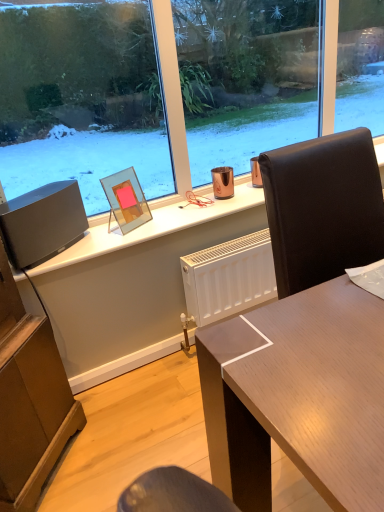
Locate an element on the screen. Image resolution: width=384 pixels, height=512 pixels. transparent glass picture frame at upper center is located at coordinates (126, 200).

This screenshot has width=384, height=512. What do you see at coordinates (126, 200) in the screenshot?
I see `transparent glass picture frame at upper center` at bounding box center [126, 200].

What do you see at coordinates (42, 223) in the screenshot?
I see `matte black speaker at left` at bounding box center [42, 223].

The image size is (384, 512). I want to click on matte black speaker at left, so click(42, 223).

Find the location of a particular element. This screenshot has height=512, width=384. transparent glass picture frame at upper center is located at coordinates (126, 200).

Between transparent glass picture frame at upper center and matte black speaker at left, which one appears on the left side from the viewer's perspective?

matte black speaker at left.

Between transparent glass picture frame at upper center and matte black speaker at left, which one is positioned behind?

Positioned behind is transparent glass picture frame at upper center.

Consider the image. Which point is more distant from viewer, (132, 222) or (22, 242)?

The point (132, 222) is farther from the camera.

From the image's perspective, who appears lower, transparent glass picture frame at upper center or matte black speaker at left?

matte black speaker at left appears lower in the image.

From a real-world perspective, who is located lower, transparent glass picture frame at upper center or matte black speaker at left?

matte black speaker at left, from a real-world perspective.

Considering the sizes of objects transparent glass picture frame at upper center and matte black speaker at left in the image provided, who is wider, transparent glass picture frame at upper center or matte black speaker at left?

matte black speaker at left is wider.

Which of these two, transparent glass picture frame at upper center or matte black speaker at left, stands taller?

Standing taller between the two is transparent glass picture frame at upper center.

Looking at the image, does transparent glass picture frame at upper center seem bigger or smaller compared to matte black speaker at left?

In the image, transparent glass picture frame at upper center appears to be smaller than matte black speaker at left.

Is transparent glass picture frame at upper center inside the boundaries of matte black speaker at left, or outside?

transparent glass picture frame at upper center cannot be found inside matte black speaker at left.

Are transparent glass picture frame at upper center and matte black speaker at left far apart?

No, there isn't a large distance between transparent glass picture frame at upper center and matte black speaker at left.

Could you tell me if transparent glass picture frame at upper center is turned towards matte black speaker at left?

No.

Can you tell me how much transparent glass picture frame at upper center and matte black speaker at left differ in facing direction?

The facing directions of transparent glass picture frame at upper center and matte black speaker at left are 5.37 degrees apart.

Identify the location of loudspeaker below the transparent glass picture frame at upper center (from a real-world perspective). The height and width of the screenshot is (512, 384). (42, 223).

Considering the positions of objects matte black speaker at left and transparent glass picture frame at upper center in the image provided, who is more to the left, matte black speaker at left or transparent glass picture frame at upper center?

matte black speaker at left is more to the left.

Consider the image. Which is in front, matte black speaker at left or transparent glass picture frame at upper center?

matte black speaker at left is in front.

Does point (76, 240) appear closer or farther from the camera than point (115, 183)?

Clearly, point (76, 240) is closer to the camera than point (115, 183).

Looking at this image, from the image's perspective, is matte black speaker at left under transparent glass picture frame at upper center?

Yes, from the image's perspective, matte black speaker at left is beneath transparent glass picture frame at upper center.

From a real-world perspective, which is physically below, matte black speaker at left or transparent glass picture frame at upper center?

matte black speaker at left, from a real-world perspective.

In the scene shown: In terms of width, does matte black speaker at left look wider or thinner when compared to transparent glass picture frame at upper center?

Clearly, matte black speaker at left has more width compared to transparent glass picture frame at upper center.

In terms of height, does matte black speaker at left look taller or shorter compared to transparent glass picture frame at upper center?

matte black speaker at left is shorter than transparent glass picture frame at upper center.

Which of these two, matte black speaker at left or transparent glass picture frame at upper center, is smaller?

transparent glass picture frame at upper center.

Can we say matte black speaker at left lies outside transparent glass picture frame at upper center?

Yes, matte black speaker at left is outside of transparent glass picture frame at upper center.

In the scene shown: Is matte black speaker at left not near transparent glass picture frame at upper center?

matte black speaker at left is actually quite close to transparent glass picture frame at upper center.

Is transparent glass picture frame at upper center at the back of matte black speaker at left?

That's not correct — matte black speaker at left is not looking away from transparent glass picture frame at upper center.

At what (x,y) coordinates should I click in order to perform the action: click on loudspeaker in front of the transparent glass picture frame at upper center. Please return your answer as a coordinate pair (x, y). This screenshot has height=512, width=384. Looking at the image, I should click on (42, 223).

The image size is (384, 512). What are the coordinates of `picture frame that appears above the matte black speaker at left (from the image's perspective)` in the screenshot? It's located at (126, 200).

Where is `picture frame above the matte black speaker at left (from a real-world perspective)`? The height and width of the screenshot is (512, 384). picture frame above the matte black speaker at left (from a real-world perspective) is located at coordinates (126, 200).